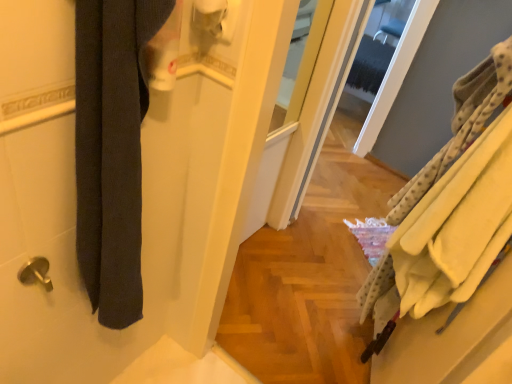
Question: Considering the relative sizes of dark gray fabric at left, marked as the second bath towel in a right-to-left arrangement, and yellow fleece bath towel at right, placed as the 2th bath towel when sorted from left to right, in the image provided, is dark gray fabric at left, marked as the second bath towel in a right-to-left arrangement, taller than yellow fleece bath towel at right, placed as the 2th bath towel when sorted from left to right,?

Choices:
 (A) yes
 (B) no

Answer: (A)

Question: Can you confirm if dark gray fabric at left, marked as the second bath towel in a right-to-left arrangement, is thinner than yellow fleece bath towel at right, placed as the 2th bath towel when sorted from left to right?

Choices:
 (A) yes
 (B) no

Answer: (A)

Question: From the image's perspective, is dark gray fabric at left, marked as the second bath towel in a right-to-left arrangement, beneath yellow fleece bath towel at right, placed as the 2th bath towel when sorted from left to right?

Choices:
 (A) no
 (B) yes

Answer: (B)

Question: Is dark gray fabric at left, marked as the 1th bath towel in a left-to-right arrangement, turned away from yellow fleece bath towel at right, placed as the 2th bath towel when sorted from left to right?

Choices:
 (A) no
 (B) yes

Answer: (A)

Question: Is dark gray fabric at left, marked as the 1th bath towel in a left-to-right arrangement, at the right side of yellow fleece bath towel at right, arranged as the first bath towel when viewed from the right?

Choices:
 (A) yes
 (B) no

Answer: (B)

Question: Is yellow fleece bath towel at right, arranged as the first bath towel when viewed from the right, wider or thinner than white matte toilet paper at upper center?

Choices:
 (A) wide
 (B) thin

Answer: (A)

Question: Considering the positions of point (417, 190) and point (202, 13), is point (417, 190) closer or farther from the camera than point (202, 13)?

Choices:
 (A) farther
 (B) closer

Answer: (A)

Question: From a real-world perspective, is yellow fleece bath towel at right, placed as the 2th bath towel when sorted from left to right, positioned above or below white matte toilet paper at upper center?

Choices:
 (A) below
 (B) above

Answer: (A)

Question: From their relative heights in the image, would you say yellow fleece bath towel at right, placed as the 2th bath towel when sorted from left to right, is taller or shorter than white matte toilet paper at upper center?

Choices:
 (A) tall
 (B) short

Answer: (A)

Question: From a real-world perspective, relative to yellow fleece bath towel at right, arranged as the first bath towel when viewed from the right, is white matte toilet paper at upper center vertically above or below?

Choices:
 (A) above
 (B) below

Answer: (A)

Question: Is white matte toilet paper at upper center wider or thinner than yellow fleece bath towel at right, placed as the 2th bath towel when sorted from left to right?

Choices:
 (A) wide
 (B) thin

Answer: (B)

Question: Considering their positions, is white matte toilet paper at upper center located in front of or behind yellow fleece bath towel at right, placed as the 2th bath towel when sorted from left to right?

Choices:
 (A) behind
 (B) front

Answer: (B)

Question: From the image's perspective, is white matte toilet paper at upper center positioned above or below yellow fleece bath towel at right, placed as the 2th bath towel when sorted from left to right?

Choices:
 (A) above
 (B) below

Answer: (A)

Question: Is dark gray fabric at left, marked as the 1th bath towel in a left-to-right arrangement, spatially inside white matte toilet paper at upper center, or outside of it?

Choices:
 (A) inside
 (B) outside

Answer: (B)

Question: Looking at their shapes, would you say dark gray fabric at left, marked as the second bath towel in a right-to-left arrangement, is wider or thinner than white matte toilet paper at upper center?

Choices:
 (A) wide
 (B) thin

Answer: (A)